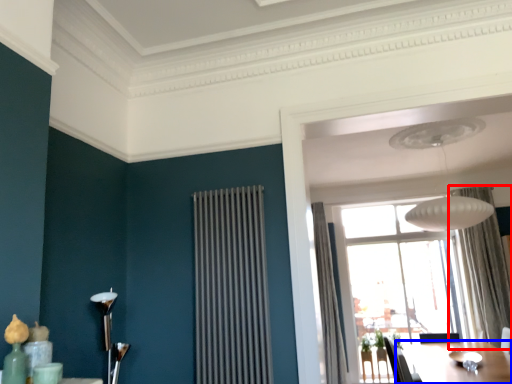
Question: Among these objects, which one is nearest to the camera, curtain (highlighted by a red box) or table (highlighted by a blue box)?

Choices:
 (A) curtain
 (B) table

Answer: (B)